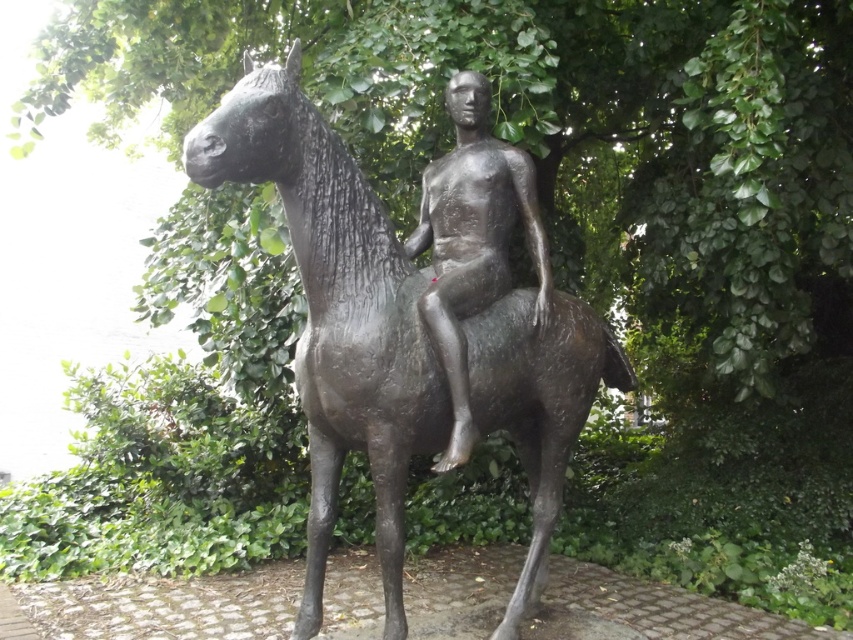
You are an art student trying to sketch the scene. You need to decide the order of drawing the green leafy tree at center and the polished bronze statue at center. Which one should you draw first to accurately represent their positions in the image?

The green leafy tree at center is above the polished bronze statue at center, so you should draw the polished bronze statue at center first and then add the green leafy tree at center on top of it.

You are an art student visiting the park and see the bronze statue of a horse at center and the polished bronze statue at center. Which one is bigger?

The bronze statue of a horse at center is larger in size than the polished bronze statue at center.

In the scene shown: You are an art student analyzing the sculpture in the park. You observe the bronze statue of a horse at center and the polished bronze statue at center. Which one is taller?

The bronze statue of a horse at center is taller than the polished bronze statue at center.